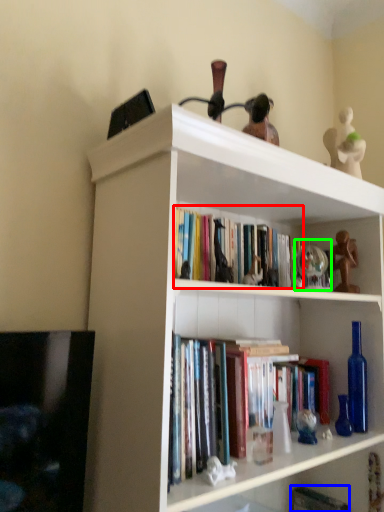
Question: Considering the real-world distances, which object is closest to book (highlighted by a red box)? paperback book (highlighted by a blue box) or toy (highlighted by a green box).

Choices:
 (A) paperback book
 (B) toy

Answer: (B)